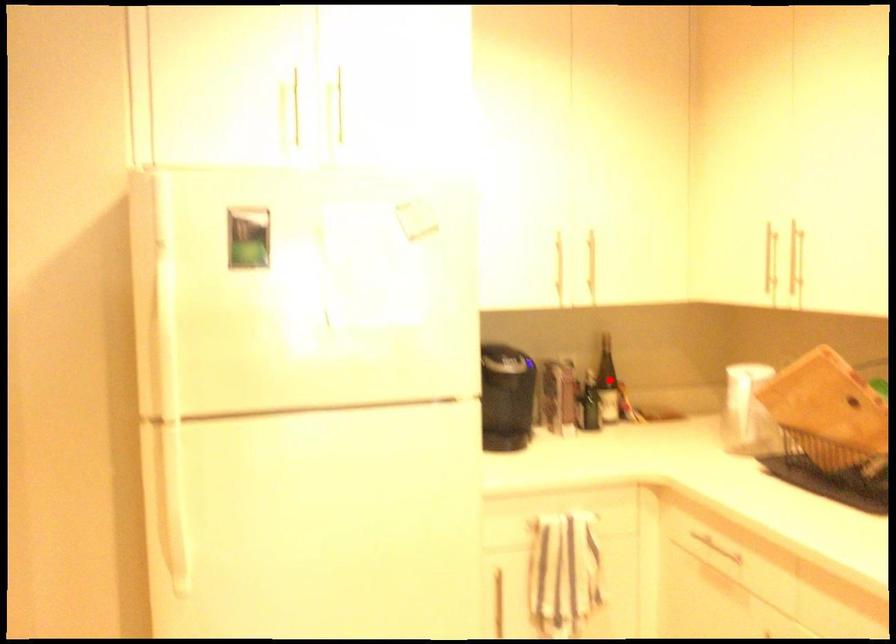
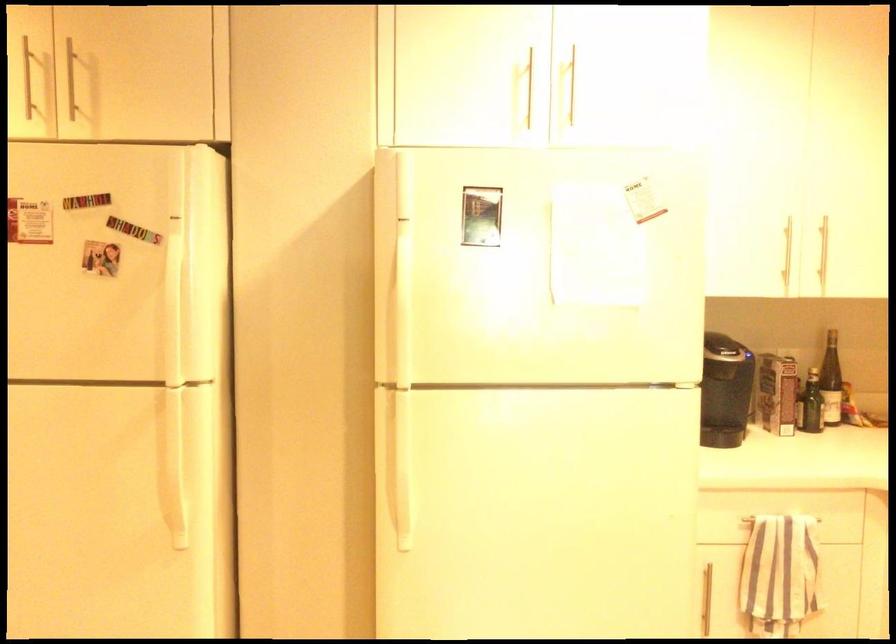
Where in the second image is the point corresponding to the highlighted location from the first image?

(831, 381)